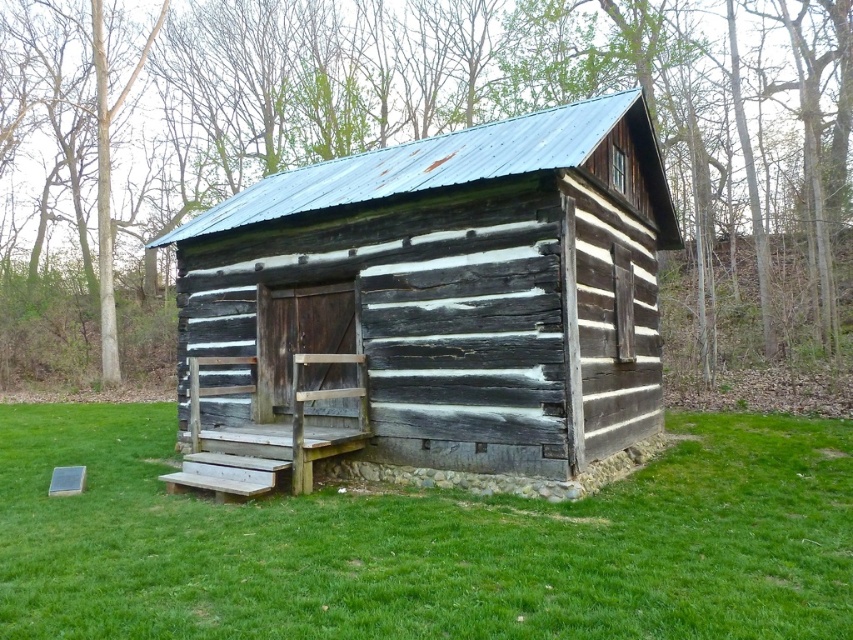
Question: Which of the following is the closest to the observer?

Choices:
 (A) weathered wood cabin at center
 (B) green grass at lower center

Answer: (B)

Question: Which of the following is the farthest from the observer?

Choices:
 (A) (331, 515)
 (B) (285, 188)

Answer: (B)

Question: Does weathered wood cabin at center have a lesser width compared to green grass at lower center?

Choices:
 (A) yes
 (B) no

Answer: (A)

Question: Is weathered wood cabin at center wider than green grass at lower center?

Choices:
 (A) yes
 (B) no

Answer: (B)

Question: Is weathered wood cabin at center behind green grass at lower center?

Choices:
 (A) yes
 (B) no

Answer: (A)